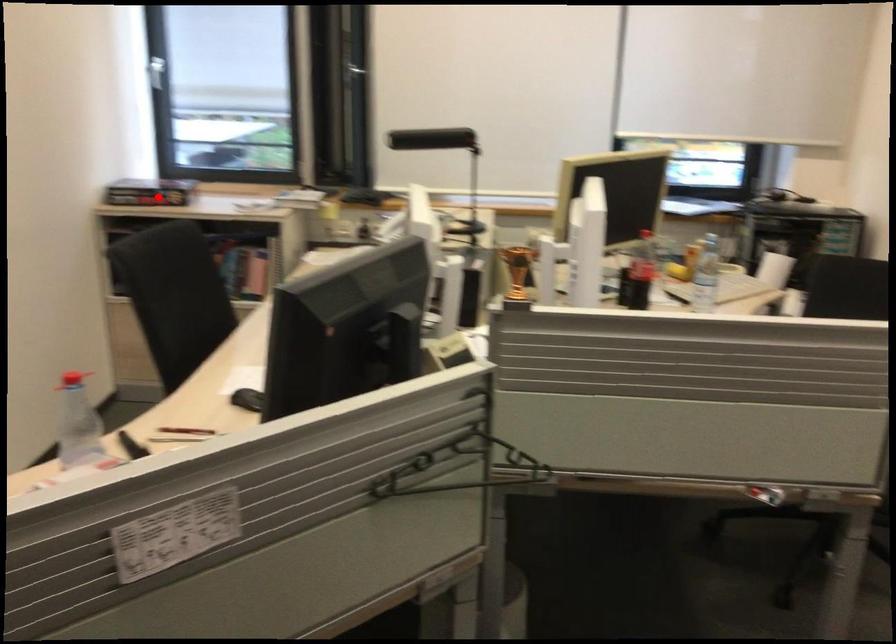
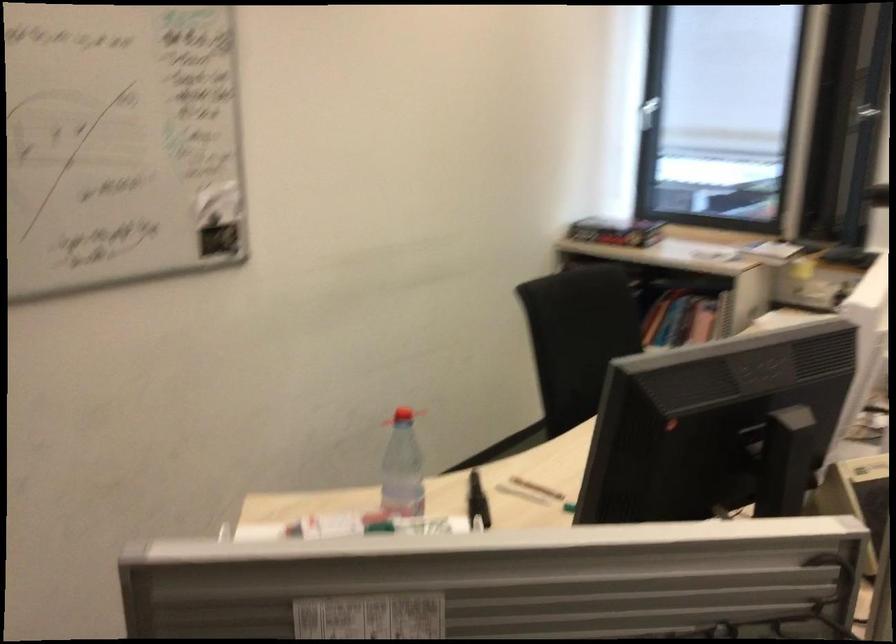
In the second image, find the point that corresponds to the highlighted location in the first image.

(615, 232)